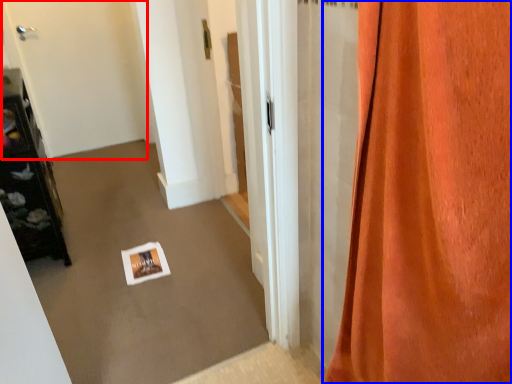
Question: Among these objects, which one is nearest to the camera, door (highlighted by a red box) or curtain (highlighted by a blue box)?

Choices:
 (A) door
 (B) curtain

Answer: (B)